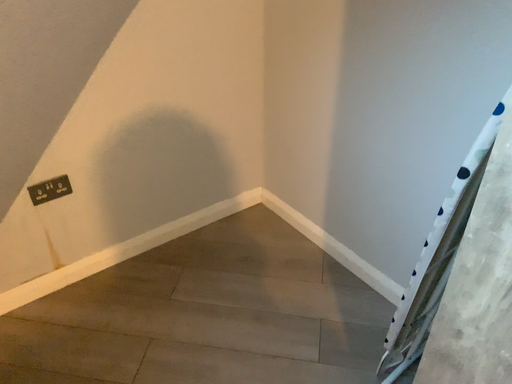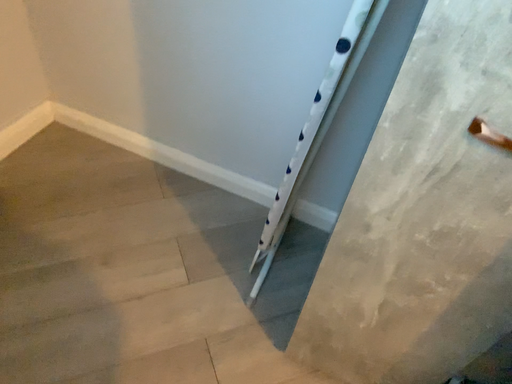
Question: Which way did the camera rotate in the video?

Choices:
 (A) rotated right
 (B) rotated left

Answer: (A)